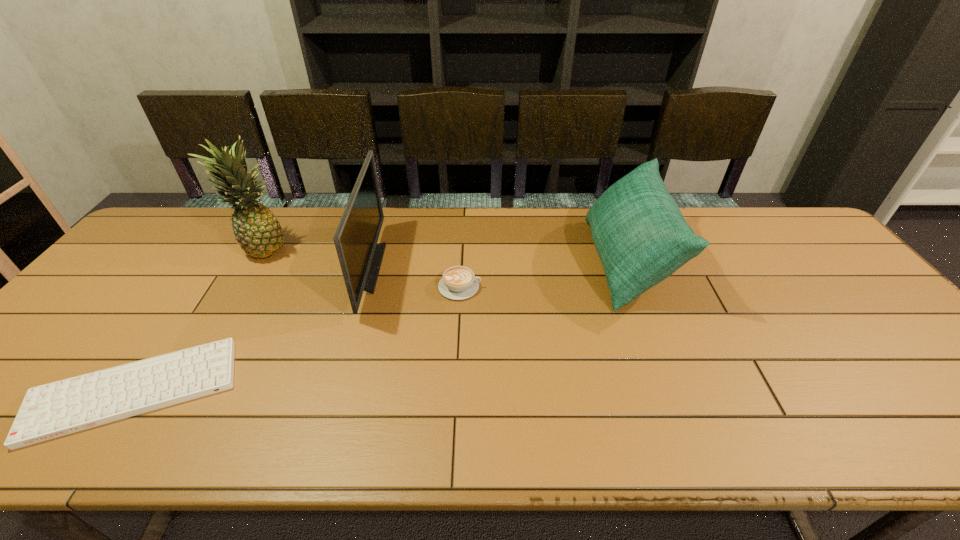
Locate an element on the screen. The image size is (960, 540). free space between the rightmost object and the monitor is located at coordinates (496, 265).

Find the location of `empty location between the tallest object and the monitor`. empty location between the tallest object and the monitor is located at coordinates (315, 258).

The height and width of the screenshot is (540, 960). Identify the location of vacant space that's between the cushion and the tallest object. (445, 254).

This screenshot has width=960, height=540. I want to click on vacant space in between the cushion and the cappuccino, so click(543, 274).

Locate an element on the screen. This screenshot has width=960, height=540. free space between the rightmost object and the tallest object is located at coordinates (445, 254).

Find the location of a particular element. Image resolution: width=960 pixels, height=540 pixels. free space between the rightmost object and the tallest object is located at coordinates (445, 254).

Identify which object is located as the third nearest to the rightmost object. Please provide its 2D coordinates. Your answer should be formatted as a tuple, i.e. [(x, y)], where the tuple contains the x and y coordinates of a point satisfying the conditions above.

[(48, 411)]

Identify the location of object that is the fourth closest to the cappuccino. (256, 229).